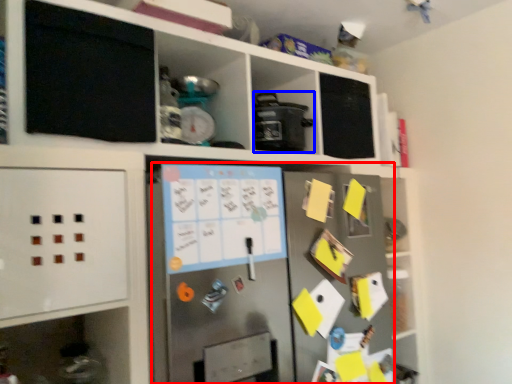
Question: Which object appears closest to the camera in this image, fridge (highlighted by a red box) or appliance (highlighted by a blue box)?

Choices:
 (A) fridge
 (B) appliance

Answer: (A)